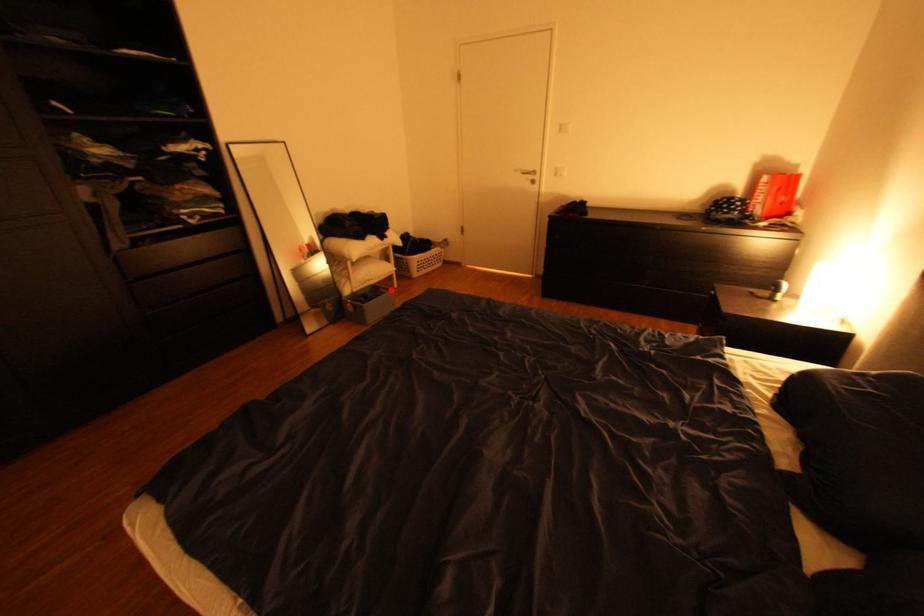
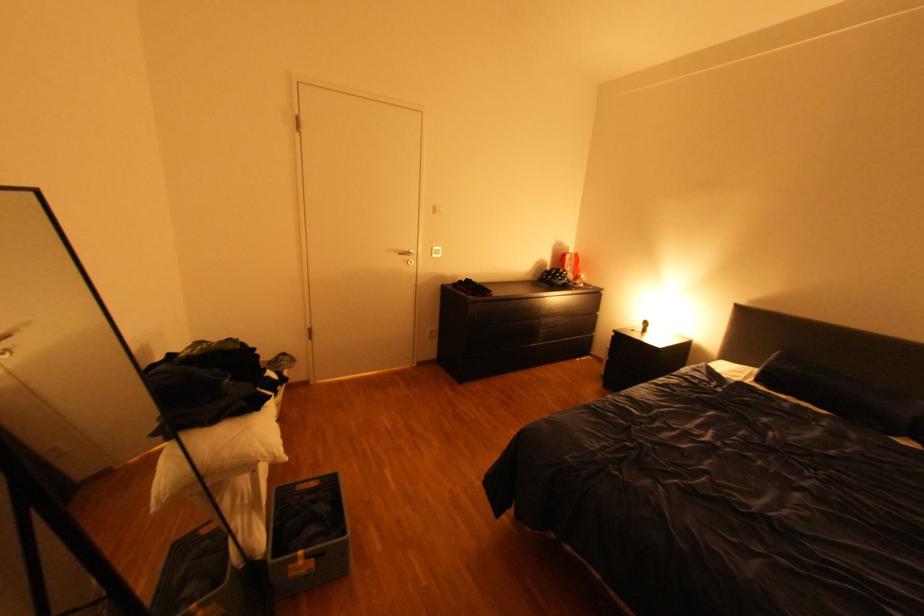
Where in the second image is the point corresponding to the highlighted location from the first image?

(310, 488)